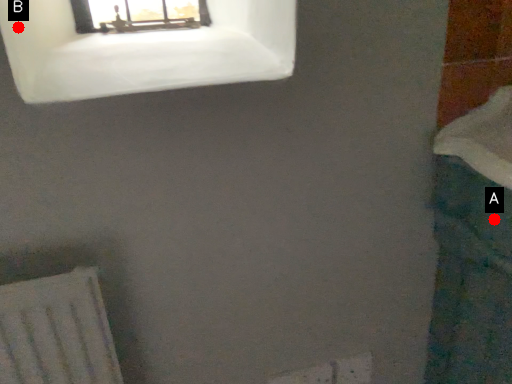
Question: Two points are circled on the image, labeled by A and B beside each circle. Among these points, which one is nearest to the camera?

Choices:
 (A) A is closer
 (B) B is closer

Answer: (B)